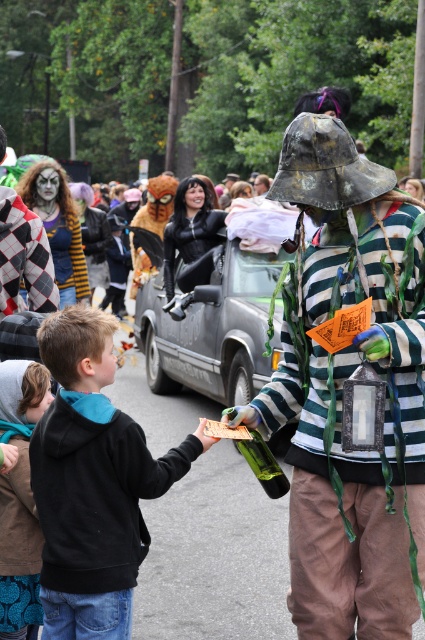
Question: Which of the following is the closest to the observer?

Choices:
 (A) rusty metal lantern at center
 (B) harlequin-patterned fabric at center

Answer: (A)

Question: Which object appears farthest from the camera in this image?

Choices:
 (A) black matte car at center
 (B) harlequin-patterned fabric at center
 (C) black leather bodysuit at center
 (D) rusty metal lantern at center

Answer: (C)

Question: Does black fleece hoodie at lower left have a larger size compared to harlequin-patterned fabric at center?

Choices:
 (A) no
 (B) yes

Answer: (B)

Question: Which of the following is the closest to the observer?

Choices:
 (A) (125, 456)
 (B) (33, 404)
 (C) (70, 241)
 (D) (402, 202)

Answer: (A)

Question: Can you confirm if black fleece hoodie at lower left is positioned above harlequin-patterned fabric at center?

Choices:
 (A) yes
 (B) no

Answer: (B)

Question: Does blue knitted sweater at lower left have a lesser width compared to harlequin-patterned fabric at center?

Choices:
 (A) yes
 (B) no

Answer: (A)